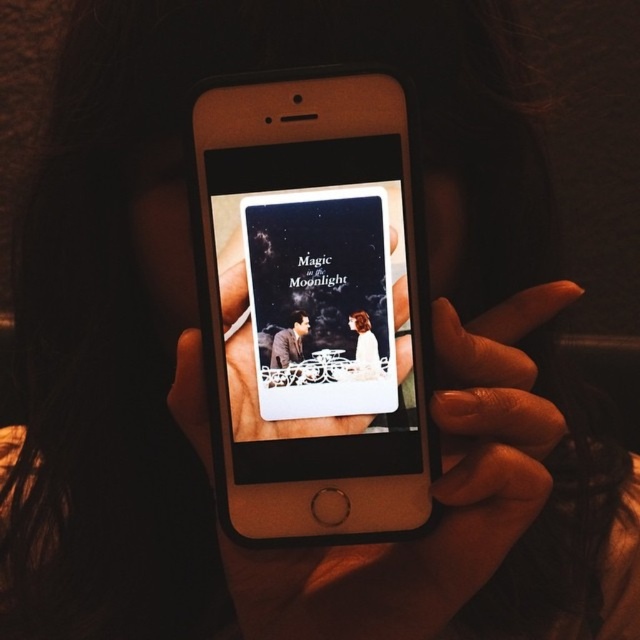
You are a photographer trying to capture the scene in the image. You notice the smooth skin hand at center and the matte plastic phone at center. Which object is located to the right of the other?

The smooth skin hand at center is positioned on the right side of the matte plastic phone at center, so the smooth skin hand at center is to the right of the matte plastic phone at center.

You are designing a display stand for a tech store that needs to showcase both the gold metallic smartphone at center and the matte plastic phone at center. The stand has two slots, one above and one below. Which phone should go in the upper slot?

The matte plastic phone at center should go in the upper slot because the gold metallic smartphone at center is positioned below it.